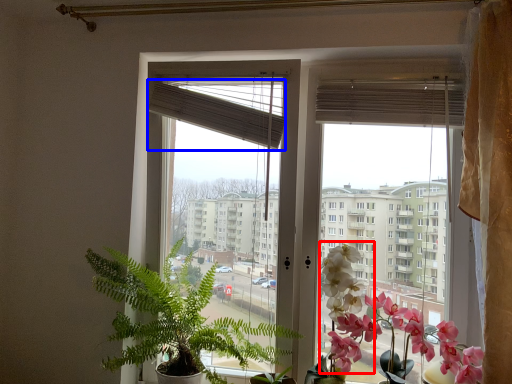
Question: Which object appears farthest to the camera in this image, flower (highlighted by a red box) or blind (highlighted by a blue box)?

Choices:
 (A) flower
 (B) blind

Answer: (B)